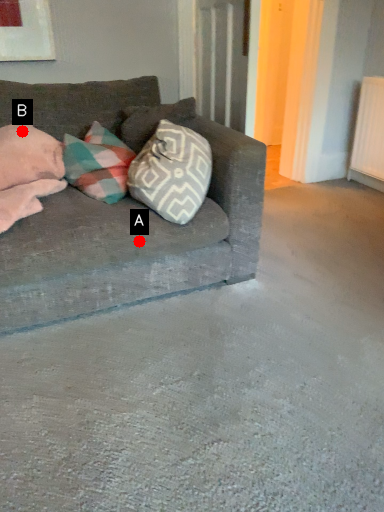
Question: Two points are circled on the image, labeled by A and B beside each circle. Among these points, which one is farthest from the camera?

Choices:
 (A) A is further
 (B) B is further

Answer: (B)